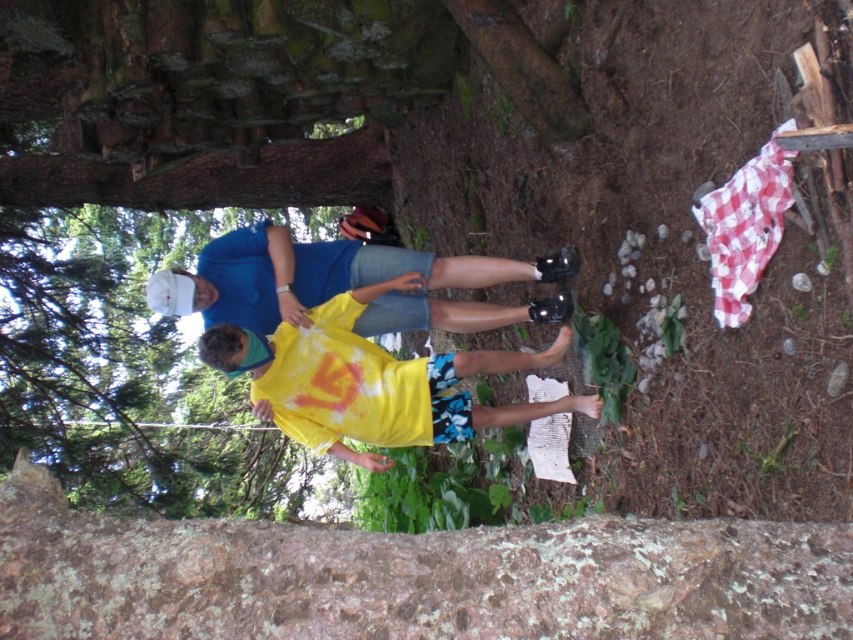
Between yellow tie-dye t-shirt at center and matte blue shirt at center, which one has less height?

matte blue shirt at center

Identify the location of yellow tie-dye t-shirt at center. (372, 381).

Between point (283, 369) and point (183, 275), which one is positioned behind?

The point (183, 275) is behind.

At what (x,y) coordinates should I click in order to perform the action: click on yellow tie-dye t-shirt at center. Please return your answer as a coordinate pair (x, y). The width and height of the screenshot is (853, 640). Looking at the image, I should click on (372, 381).